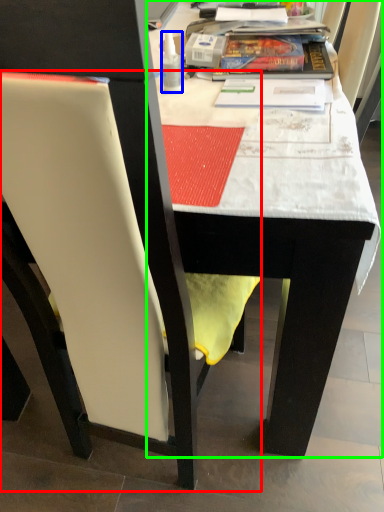
Question: Estimate the real-world distances between objects in this image. Which object is closer to chair (highlighted by a red box), bottle (highlighted by a blue box) or table (highlighted by a green box)?

Choices:
 (A) bottle
 (B) table

Answer: (B)